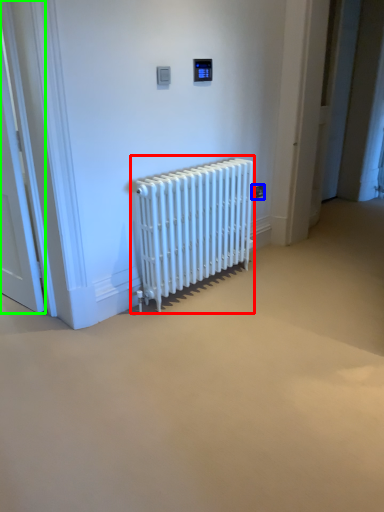
Question: Based on their relative distances, which object is nearer to radiator (highlighted by a red box)? Choose from electric outlet (highlighted by a blue box) and door (highlighted by a green box).

Choices:
 (A) electric outlet
 (B) door

Answer: (A)